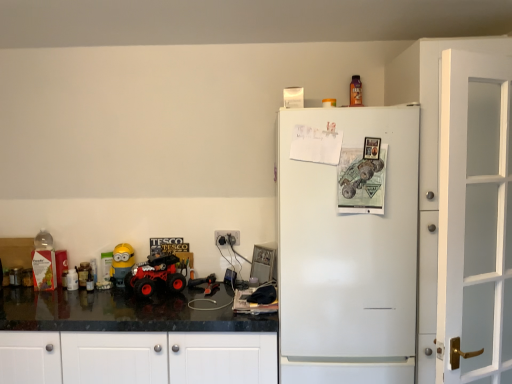
Question: Is yellow matte minion at left, which appears as the first toy when ordered from the bottom, facing towards white matte refrigerator at right?

Choices:
 (A) yes
 (B) no

Answer: (B)

Question: Is yellow matte minion at left, arranged as the 2th toy when viewed from the right, with white matte refrigerator at right?

Choices:
 (A) no
 (B) yes

Answer: (A)

Question: Is yellow matte minion at left, which appears as the second toy when viewed from the left, bigger than white matte refrigerator at right?

Choices:
 (A) no
 (B) yes

Answer: (A)

Question: Considering the relative sizes of yellow matte minion at left, arranged as the 2th toy when viewed from the right, and white matte refrigerator at right in the image provided, is yellow matte minion at left, arranged as the 2th toy when viewed from the right, smaller than white matte refrigerator at right?

Choices:
 (A) yes
 (B) no

Answer: (A)

Question: Is the depth of yellow matte minion at left, which appears as the second toy when viewed from the left, less than that of white matte refrigerator at right?

Choices:
 (A) no
 (B) yes

Answer: (A)

Question: Is yellow matte minion at left, which appears as the second toy when viewed from the left, thinner than white matte refrigerator at right?

Choices:
 (A) yes
 (B) no

Answer: (A)

Question: Does rubberized red monster truck at lower left have a lesser width compared to white glass door at right?

Choices:
 (A) yes
 (B) no

Answer: (B)

Question: Can you confirm if rubberized red monster truck at lower left is positioned to the left of white glass door at right?

Choices:
 (A) yes
 (B) no

Answer: (A)

Question: Can you confirm if rubberized red monster truck at lower left is taller than white glass door at right?

Choices:
 (A) no
 (B) yes

Answer: (A)

Question: Is rubberized red monster truck at lower left positioned with its back to white glass door at right?

Choices:
 (A) yes
 (B) no

Answer: (B)

Question: Is the depth of rubberized red monster truck at lower left less than that of white glass door at right?

Choices:
 (A) no
 (B) yes

Answer: (A)

Question: From a real-world perspective, is rubberized red monster truck at lower left beneath white glass door at right?

Choices:
 (A) no
 (B) yes

Answer: (B)

Question: Is yellow matte minion at left, which appears as the first toy when ordered from the bottom, in contact with metallic orange bottle at upper center, which is the 3th toy in bottom-to-top order?

Choices:
 (A) yes
 (B) no

Answer: (B)